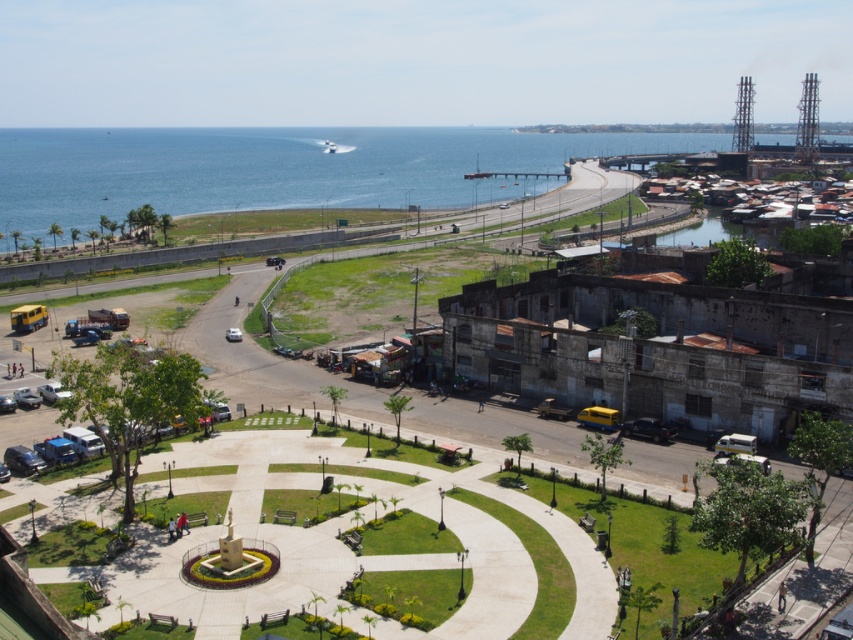
You are a delivery robot with a maximum range of 300 meters. You are currently at the white matte car at center and need to reach the blue water at lower left. Can you complete the delivery without needing a recharge?

The distance between the white matte car at center and the blue water at lower left is 299.13 meters, which is within your 300 meter range. Yes, you can complete the delivery without needing a recharge.

You are standing at the central fountain in the park and want to reach the blue water at lower left. Based on the scene description, can you determine if the distance of 185.68 meters is manageable for a 10 minute walk?

The distance of blue water at lower left from viewer is 185.68 meters. Assuming an average walking speed of 1.4 meters per second, it would take approximately 132.6 seconds or about 2.2 minutes to cover the distance. Therefore, it is manageable for a 10 minute walk.